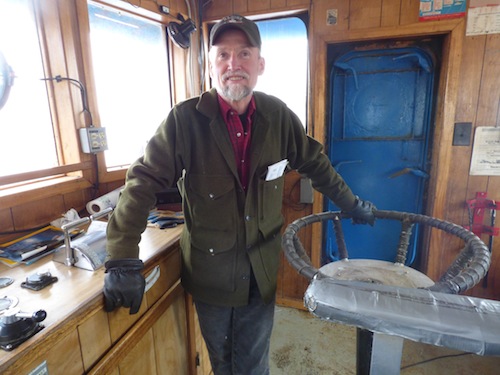
Where is `wood paneling`? The image size is (500, 375). wood paneling is located at coordinates (478, 87).